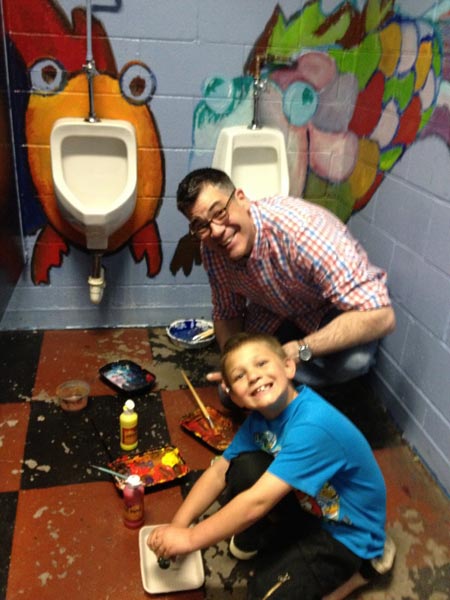
Image resolution: width=450 pixels, height=600 pixels. I want to click on urinal basin, so click(89, 210), click(264, 181).